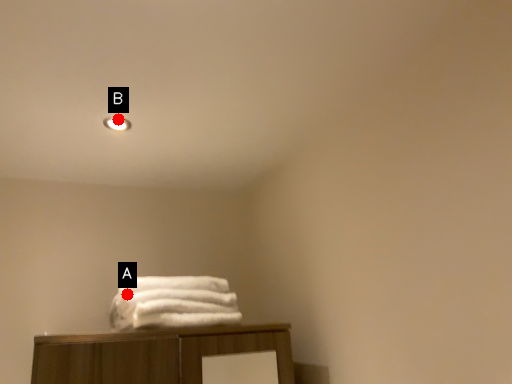
Question: Two points are circled on the image, labeled by A and B beside each circle. Among these points, which one is farthest from the camera?

Choices:
 (A) A is further
 (B) B is further

Answer: (B)